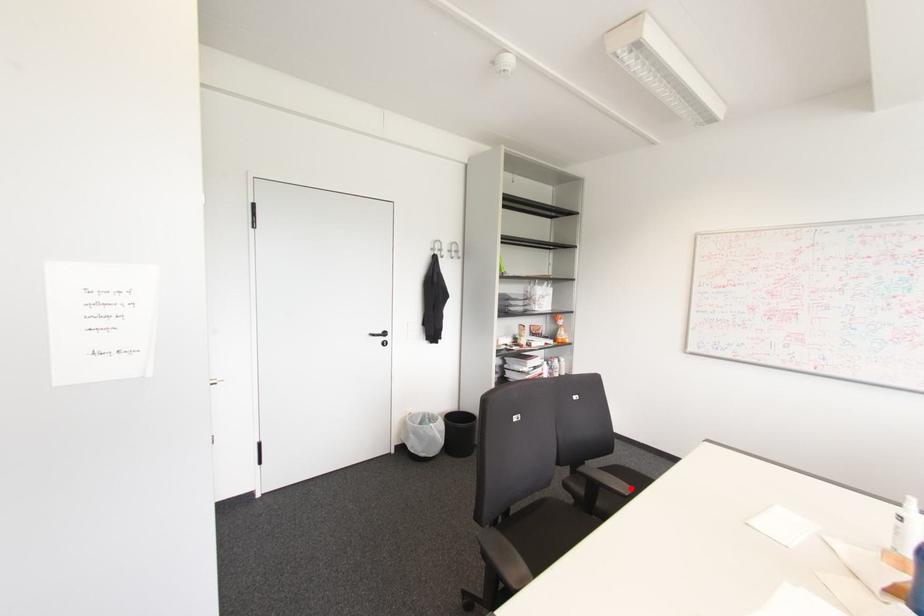
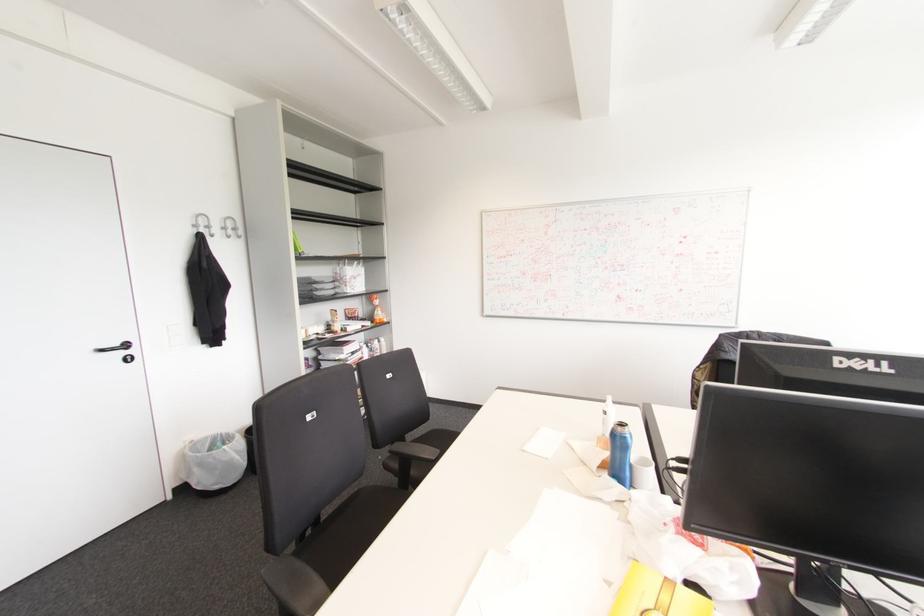
Question: I am providing you with two images of the same scene from different viewpoints. In image1, a red point is highlighted. Considering the same 3D point in image2, which of the following is correct?

Choices:
 (A) It is closer
 (B) It is farther

Answer: (A)